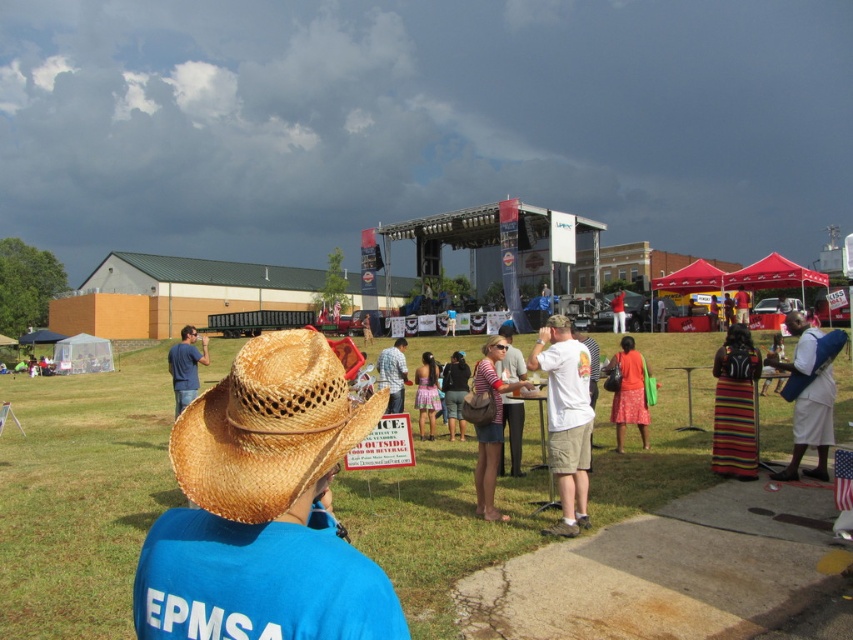
Question: Among these objects, which one is farthest from the camera?

Choices:
 (A) printed cotton dress at center
 (B) striped fabric dress at lower right

Answer: (A)

Question: Among these objects, which one is farthest from the camera?

Choices:
 (A) dark gray fabric backpack at center
 (B) straw woven cowboy hat at center
 (C) white cotton shirt at center

Answer: (A)

Question: Can you confirm if white cotton shirt at center is positioned above dark gray fabric backpack at center?

Choices:
 (A) yes
 (B) no

Answer: (A)

Question: Which point is closer to the camera?

Choices:
 (A) (424, 404)
 (B) (77, 388)
 (C) (819, 452)

Answer: (C)

Question: Does matte brown cowboy hat at center appear under red fabric dress at center?

Choices:
 (A) yes
 (B) no

Answer: (A)

Question: In this image, where is white cotton shirt at right located relative to blue denim jeans at left?

Choices:
 (A) above
 (B) below

Answer: (A)